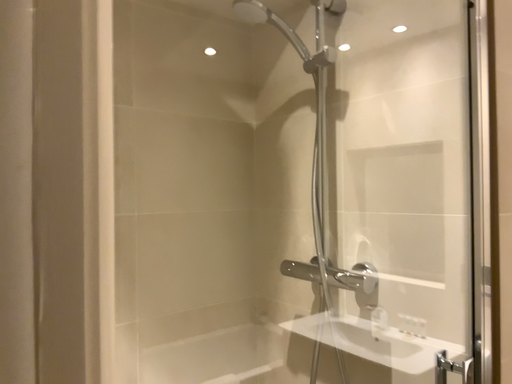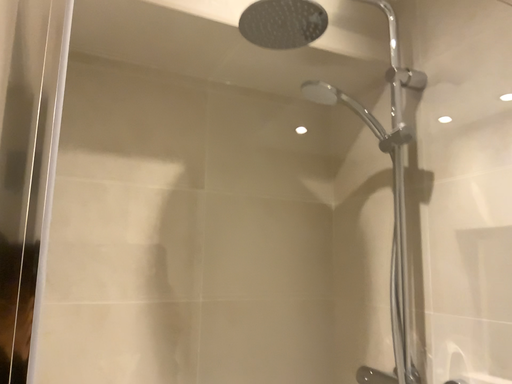
Question: How did the camera likely rotate when shooting the video?

Choices:
 (A) rotated downward
 (B) rotated upward

Answer: (B)